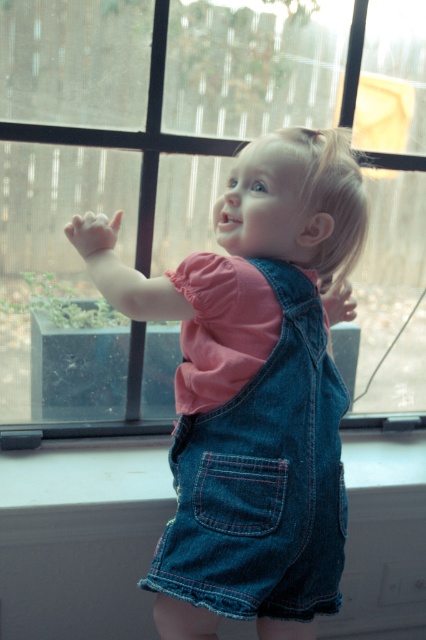
Please determine the coordinates of the clear glass window at center in the image based on the provided scene description. The coordinate system is normalized, meaning the top left corner is at position 0.0 and the bottom right is at 1.0. What are its coordinates?

The clear glass window at center is located at coordinates 0.203 on the x axis and 0.479 on the y axis.

You are a photographer trying to capture the child in the scene. You notice two points marked in the image. The first point is at coordinates point (x=100, y=240) and the second is at point (x=293, y=312). Which point is closer to the camera lens?

Point (x=100, y=240) is closer to the camera lens because it is further to the viewer than point (x=293, y=312).

The child is standing in front of the clear glass window at center and wearing the denim overalls at center. Which object takes up more space in the image?

The clear glass window at center is bigger than the denim overalls at center, so it takes up more space in the image.